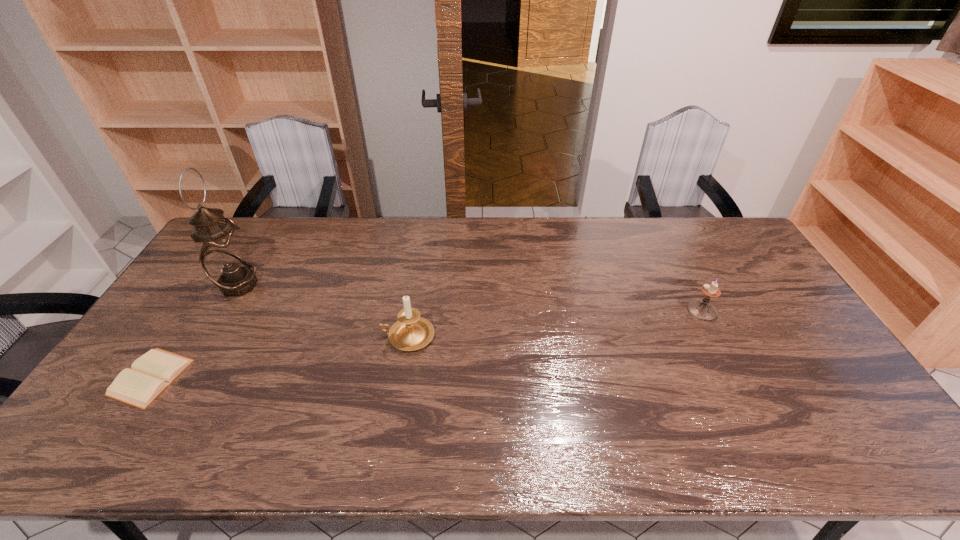
Locate an element on the screen. This screenshot has height=540, width=960. blank region between the second object from right to left and the second shortest object is located at coordinates (555, 323).

Locate an element on the screen. The height and width of the screenshot is (540, 960). vacant point located between the taller candle holder and the shortest object is located at coordinates (279, 357).

Image resolution: width=960 pixels, height=540 pixels. Find the location of `empty space between the left candle holder and the second shortest object`. empty space between the left candle holder and the second shortest object is located at coordinates (555, 323).

In order to click on vacant space that is in between the shortest object and the tallest object in this screenshot , I will do `click(195, 332)`.

The height and width of the screenshot is (540, 960). Find the location of `vacant space that is in between the diary and the tallest object`. vacant space that is in between the diary and the tallest object is located at coordinates (195, 332).

Locate an element on the screen. unoccupied position between the shortest object and the tallest object is located at coordinates (195, 332).

Locate an element on the screen. the closest object to the left candle holder is located at coordinates (224, 258).

Select which object appears as the second closest to the second shortest object. Please provide its 2D coordinates. Your answer should be formatted as a tuple, i.e. [(x, y)], where the tuple contains the x and y coordinates of a point satisfying the conditions above.

[(224, 258)]